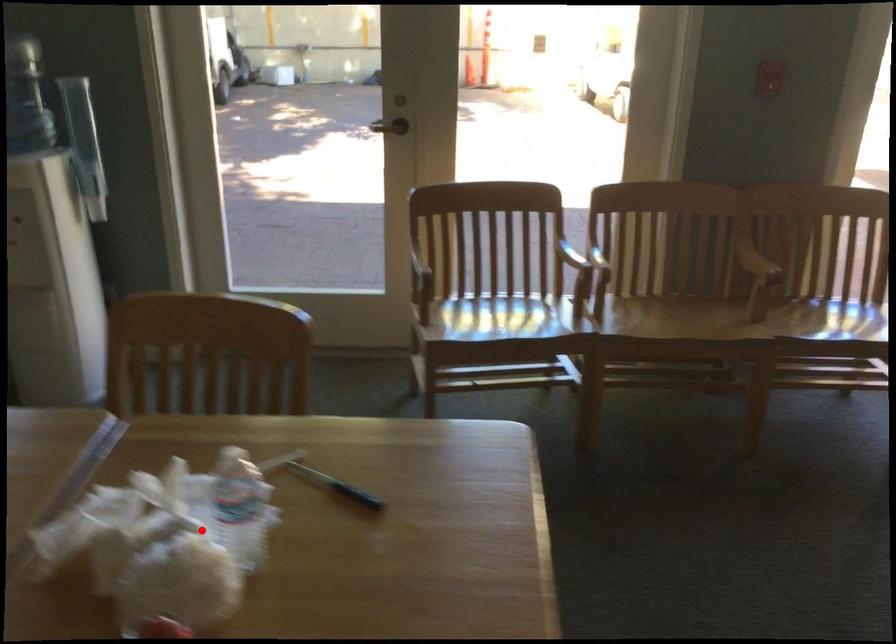
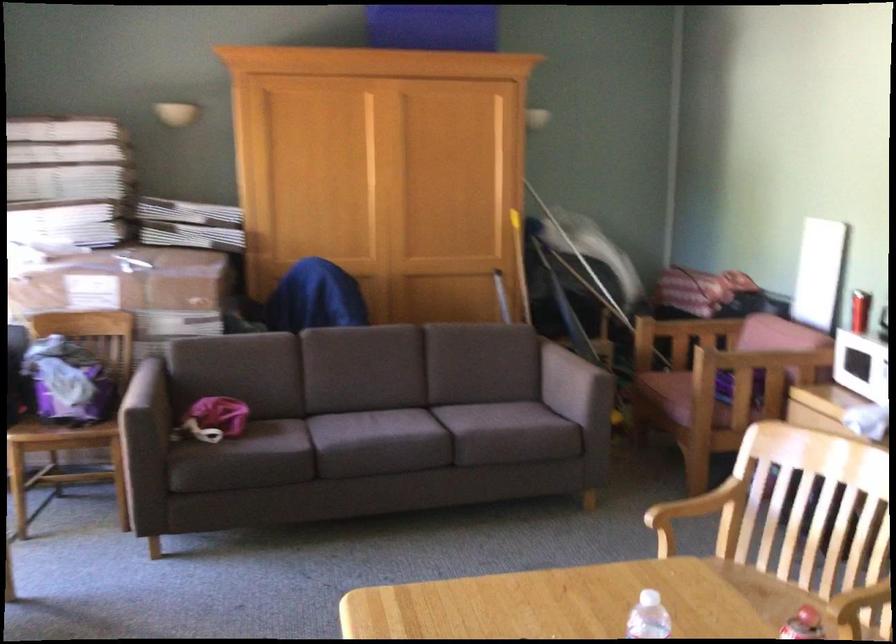
The point at the highlighted location is marked in the first image. Where is the corresponding point in the second image?

(648, 617)